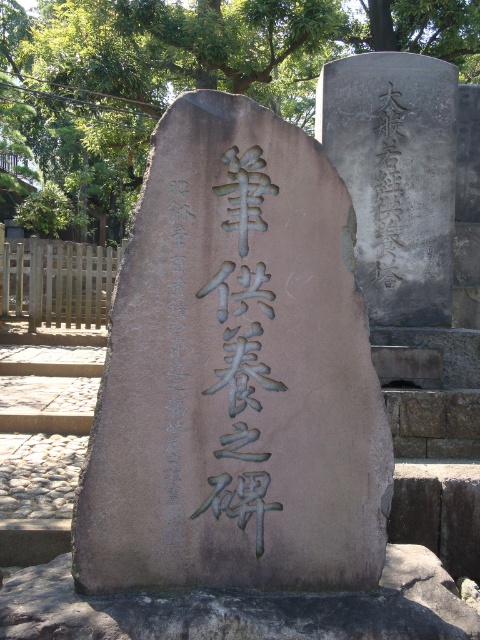
Question: Is brown polished stone monument at center positioned before smooth gray stone at upper right?

Choices:
 (A) no
 (B) yes

Answer: (B)

Question: From the image, what is the correct spatial relationship of smooth gray stone at upper right in relation to black stone inscription at center?

Choices:
 (A) above
 (B) below

Answer: (A)

Question: Does brown polished stone monument at center appear on the right side of smooth gray stone at upper right?

Choices:
 (A) no
 (B) yes

Answer: (A)

Question: Which point is closer to the camera?

Choices:
 (A) brown polished stone monument at center
 (B) smooth gray stone at upper right

Answer: (A)

Question: Estimate the real-world distances between objects in this image. Which object is closer to the black stone inscription at center?

Choices:
 (A) brown polished stone monument at center
 (B) smooth gray stone at upper right

Answer: (A)

Question: Which point is farther to the camera?

Choices:
 (A) brown polished stone monument at center
 (B) smooth gray stone at upper right

Answer: (B)